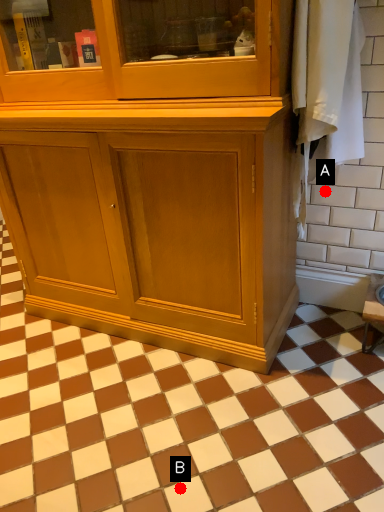
Question: Two points are circled on the image, labeled by A and B beside each circle. Which point is farther from the camera taking this photo?

Choices:
 (A) A is further
 (B) B is further

Answer: (A)